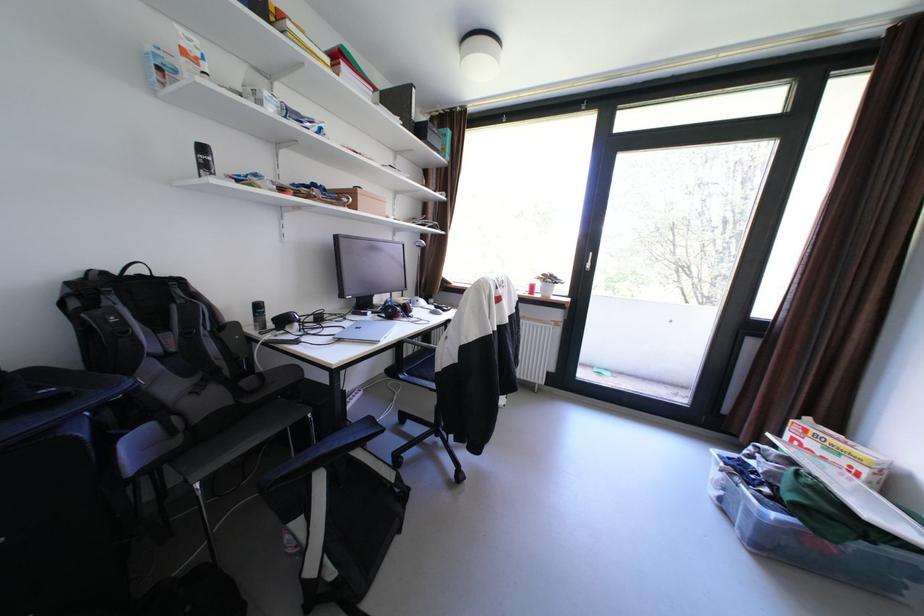
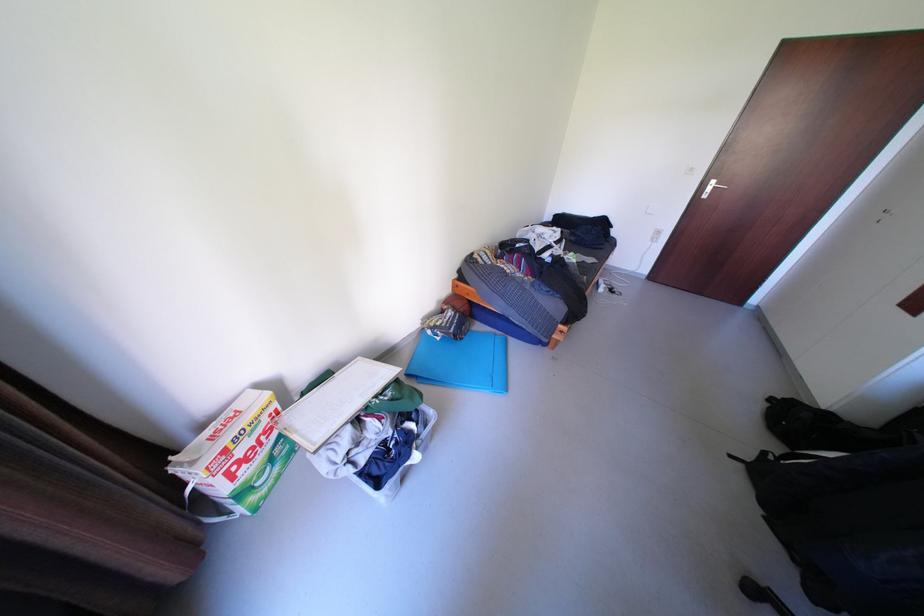
The point at (762, 463) is marked in the first image. Where is the corresponding point in the second image?

(372, 459)